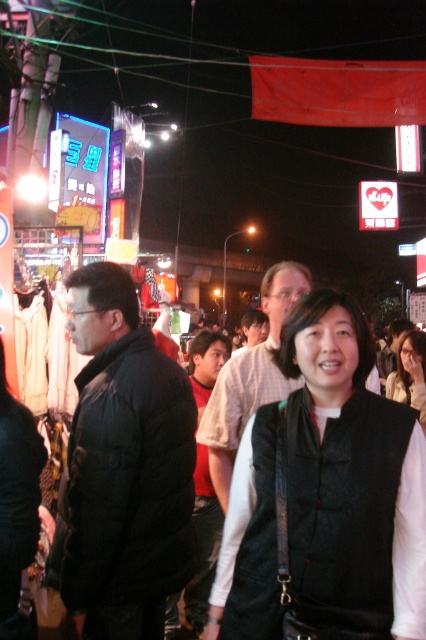
You are a photographer trying to capture a photo of the street scene. You notice two points marked in the image. The first point is at coordinates point (23, 624) and the second point is at point (245, 323). Which of these two points is closer to the camera?

Point (23, 624) is closer to the camera than point (245, 323).

From the picture: You are a photographer trying to capture a clear shot of the black fabric vest at center and the light brown shirt at center. Which object should you focus on if you want to ensure both are in frame without moving the camera?

You should focus on the black fabric vest at center because it is wider than the light brown shirt at center, so centering the vest ensures both are within the frame.